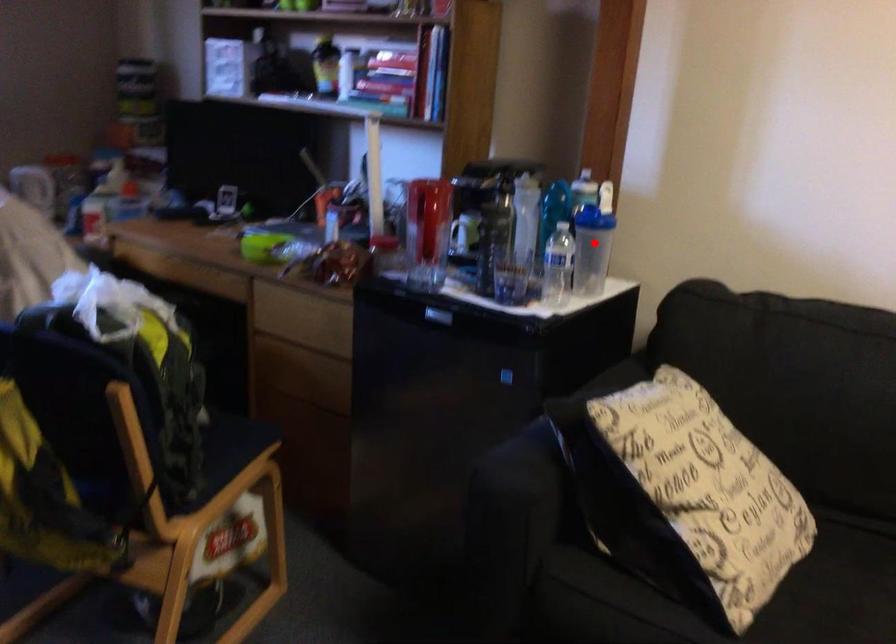
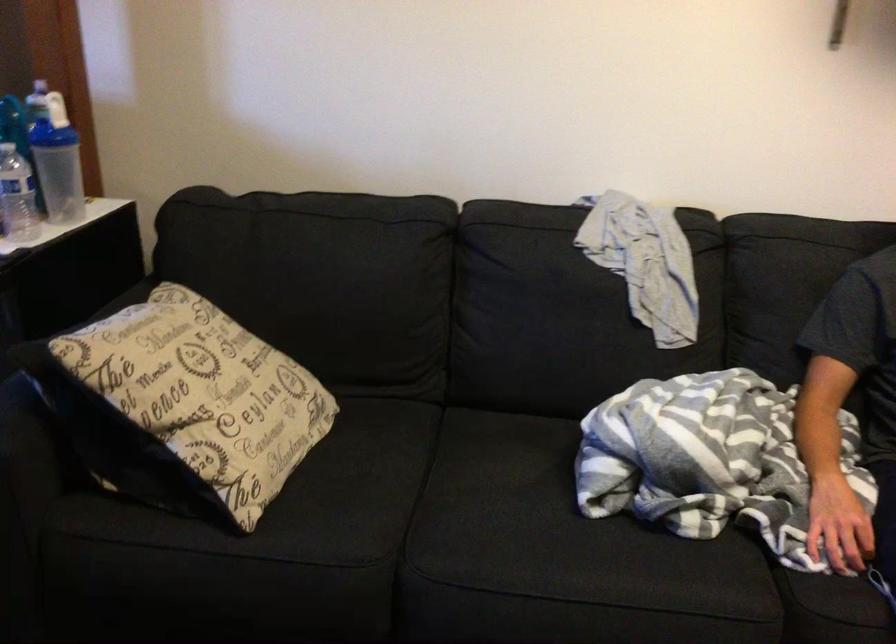
Find the pixel in the second image that matches the highlighted location in the first image.

(56, 161)